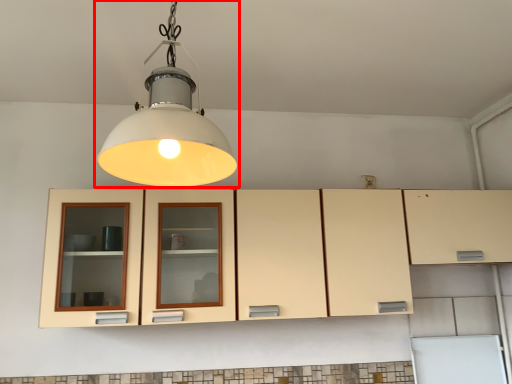
Question: From the image's perspective, where is lamp (annotated by the red box) located relative to cabinetry?

Choices:
 (A) above
 (B) below

Answer: (A)